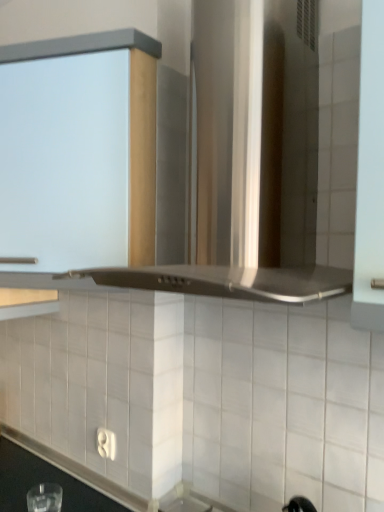
The height and width of the screenshot is (512, 384). Describe the element at coordinates (75, 163) in the screenshot. I see `white matte cabinet at upper left` at that location.

This screenshot has width=384, height=512. In order to click on white matte cabinet at upper left in this screenshot , I will do `click(75, 163)`.

The image size is (384, 512). What are the coordinates of `stainless steel vent at center` in the screenshot? It's located at (218, 204).

What do you see at coordinates (218, 204) in the screenshot?
I see `stainless steel vent at center` at bounding box center [218, 204].

Locate an element on the screen. The height and width of the screenshot is (512, 384). white matte cabinet at upper left is located at coordinates (75, 163).

Between white matte cabinet at upper left and stainless steel vent at center, which one appears on the right side from the viewer's perspective?

From the viewer's perspective, stainless steel vent at center appears more on the right side.

Which object is more forward, white matte cabinet at upper left or stainless steel vent at center?

Positioned in front is stainless steel vent at center.

Which is behind, point (59, 99) or point (226, 108)?

The point (59, 99) is behind.

From the image's perspective, is white matte cabinet at upper left above or below stainless steel vent at center?

Clearly, from the image's perspective, white matte cabinet at upper left is below stainless steel vent at center.

From a real-world perspective, between white matte cabinet at upper left and stainless steel vent at center, who is vertically lower?

white matte cabinet at upper left is physically lower.

Which object is thinner, white matte cabinet at upper left or stainless steel vent at center?

Thinner between the two is white matte cabinet at upper left.

Is white matte cabinet at upper left shorter than stainless steel vent at center?

Yes, white matte cabinet at upper left is shorter than stainless steel vent at center.

From the picture: Between white matte cabinet at upper left and stainless steel vent at center, which one has smaller size?

white matte cabinet at upper left.

Is white matte cabinet at upper left outside of stainless steel vent at center?

Absolutely, white matte cabinet at upper left is external to stainless steel vent at center.

Is white matte cabinet at upper left not near stainless steel vent at center?

No, white matte cabinet at upper left is not far away from stainless steel vent at center.

Is white matte cabinet at upper left oriented towards stainless steel vent at center?

No, white matte cabinet at upper left does not turn towards stainless steel vent at center.

How many degrees apart are the facing directions of white matte cabinet at upper left and stainless steel vent at center?

0.646 degrees separate the facing orientations of white matte cabinet at upper left and stainless steel vent at center.

The width and height of the screenshot is (384, 512). Find the location of `vent above the white matte cabinet at upper left (from a real-world perspective)`. vent above the white matte cabinet at upper left (from a real-world perspective) is located at coordinates (218, 204).

In the image, is stainless steel vent at center on the left side or the right side of white matte cabinet at upper left?

In the image, stainless steel vent at center appears on the right side of white matte cabinet at upper left.

In the image, is stainless steel vent at center positioned in front of or behind white matte cabinet at upper left?

Clearly, stainless steel vent at center is in front of white matte cabinet at upper left.

Is point (249, 78) positioned after point (68, 73)?

No, (249, 78) is in front of (68, 73).

From the image's perspective, which one is positioned higher, stainless steel vent at center or white matte cabinet at upper left?

stainless steel vent at center is shown above in the image.

From a real-world perspective, which is physically below, stainless steel vent at center or white matte cabinet at upper left?

white matte cabinet at upper left, from a real-world perspective.

Is stainless steel vent at center wider or thinner than white matte cabinet at upper left?

Considering their sizes, stainless steel vent at center looks broader than white matte cabinet at upper left.

Can you confirm if stainless steel vent at center is taller than white matte cabinet at upper left?

Yes.

Who is smaller, stainless steel vent at center or white matte cabinet at upper left?

white matte cabinet at upper left.

Consider the image. Could white matte cabinet at upper left be considered to be inside stainless steel vent at center?

No.

From the picture: Are stainless steel vent at center and white matte cabinet at upper left making contact?

No, stainless steel vent at center is not making contact with white matte cabinet at upper left.

Is white matte cabinet at upper left at the back of stainless steel vent at center?

No.

You are a GUI agent. You are given a task and a screenshot of the screen. Output one action in this format:
    pyautogui.click(x=<x>, y=<y>)
    Task: Click on the vent above the white matte cabinet at upper left (from the image's perspective)
    Image resolution: width=384 pixels, height=512 pixels.
    Given the screenshot: What is the action you would take?
    pyautogui.click(x=218, y=204)

Where is `cabinetry below the stainless steel vent at center (from a real-world perspective)`? This screenshot has width=384, height=512. cabinetry below the stainless steel vent at center (from a real-world perspective) is located at coordinates (75, 163).

The image size is (384, 512). Find the location of `cabinetry below the stainless steel vent at center (from the image's perspective)`. cabinetry below the stainless steel vent at center (from the image's perspective) is located at coordinates (75, 163).